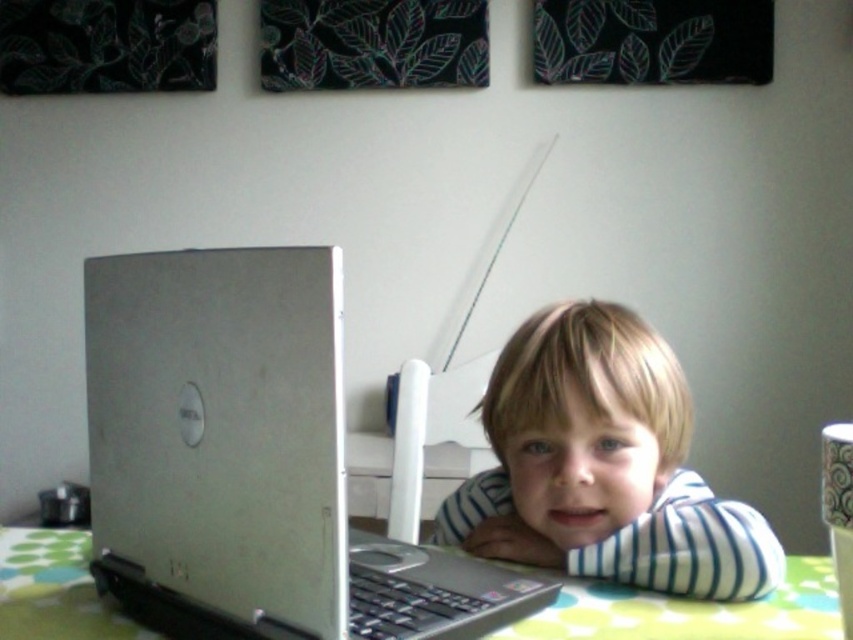
You are a photographer trying to capture a closeup of the laptop screen. You notice two points on the table surface marked as point (717, 502) and point (816, 586). Which point should you focus on to ensure the laptop screen is in focus?

Point (717, 502) is further to the camera than point (816, 586). Therefore, focusing on point (717, 502) will ensure the laptop screen is in focus since it is closer to the camera.

You are a photographer trying to capture a closeup of the silver metallic laptop at center and the blonde hair at center in the image. The camera you are using has a maximum focus range of 8 inches. Can you focus on both objects simultaneously?

The silver metallic laptop at center and blonde hair at center are 8.17 inches apart from each other. Since the camera can only focus within 8 inches, the distance between them exceeds the focus range. Therefore, you cannot focus on both simultaneously.

You are a photographer setting up for a portrait session. You need to ensure that the blonde hair at center and the green dotted fabric at lower center are both visible in the frame. Based on their positions, which object should you adjust your camera angle to focus on first to capture both elements?

The blonde hair at center is positioned on the right side of green dotted fabric at lower center. To capture both elements, adjust the camera angle to focus on the green dotted fabric at lower center first, then ensure the blonde hair at center on its right is also in frame.